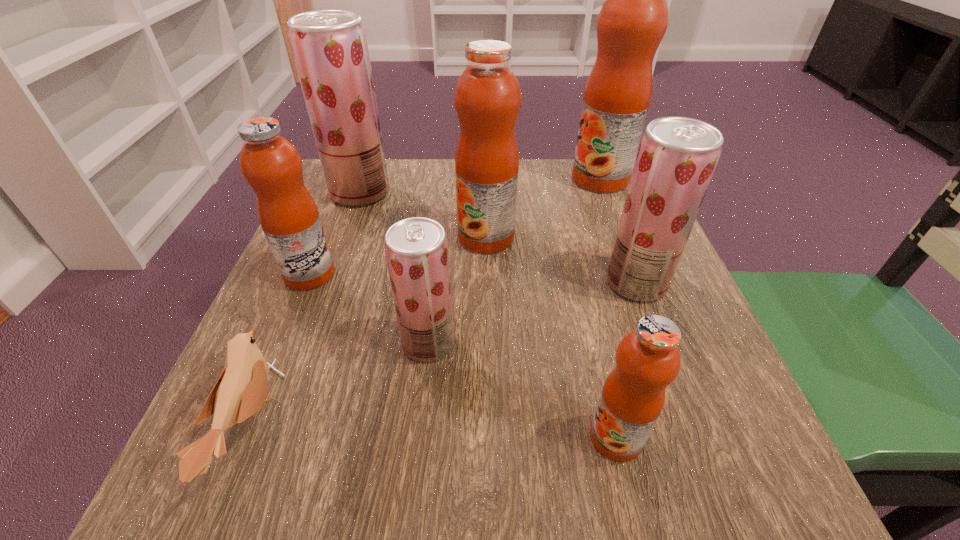
I want to click on the tallest fruit juice, so click(633, 19).

Locate an element on the screen. the farthest orange fruit juice is located at coordinates (633, 19).

Image resolution: width=960 pixels, height=540 pixels. Find the location of `the leftmost strawberry fruit juice`. the leftmost strawberry fruit juice is located at coordinates (330, 49).

Identify the location of the biggest strawberry fruit juice. Image resolution: width=960 pixels, height=540 pixels. (330, 49).

At what (x,y) coordinates should I click in order to perform the action: click on the third farthest object. Please return your answer as a coordinate pair (x, y). This screenshot has height=540, width=960. Looking at the image, I should click on (487, 98).

Locate an element on the screen. The width and height of the screenshot is (960, 540). the second orange fruit juice from left to right is located at coordinates (487, 98).

In order to click on the rightmost strawberry fruit juice in this screenshot , I will do `click(677, 156)`.

At what (x,y) coordinates should I click in order to perform the action: click on the second nearest strawberry fruit juice. Please return your answer as a coordinate pair (x, y). Looking at the image, I should click on (677, 156).

Find the location of a particular element. This screenshot has width=960, height=540. the third farthest orange fruit juice is located at coordinates click(272, 166).

At what (x,y) coordinates should I click in order to perform the action: click on the leftmost orange fruit juice. Please return your answer as a coordinate pair (x, y). Image resolution: width=960 pixels, height=540 pixels. Looking at the image, I should click on (272, 166).